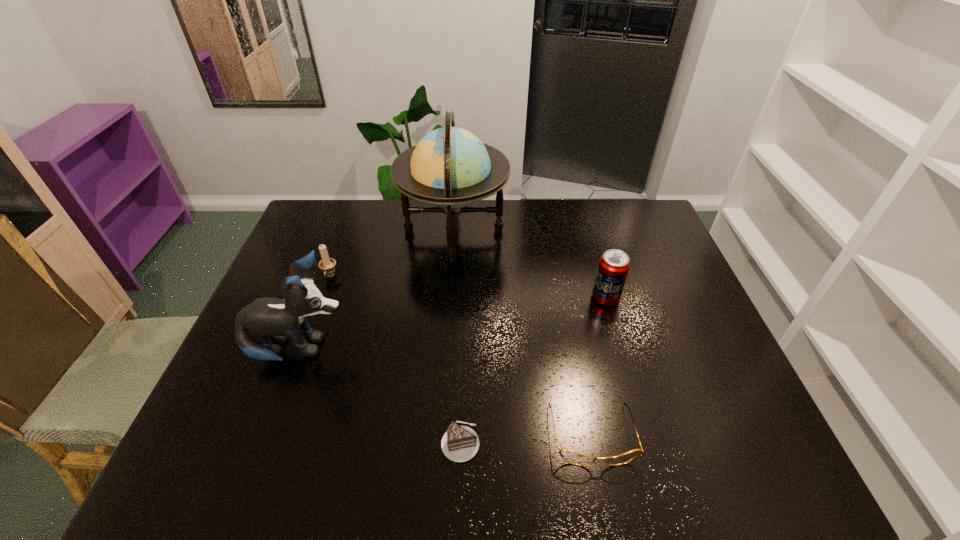
Image resolution: width=960 pixels, height=540 pixels. I want to click on empty space between the chocolate cake and the third nearest object, so [380, 397].

At what (x,y) coordinates should I click in order to perform the action: click on vacant space that's between the fourth nearest object and the third shortest object. Please return your answer as a coordinate pair (x, y). Looking at the image, I should click on (468, 287).

In order to click on free space between the spectacles and the chocolate cake in this screenshot , I will do `click(526, 438)`.

Find the location of a particular element. The image size is (960, 540). vacant space that's between the chocolate cake and the candle_holder is located at coordinates (396, 360).

Identify which object is located as the second nearest to the globe. Please provide its 2D coordinates. Your answer should be formatted as a tuple, i.e. [(x, y)], where the tuple contains the x and y coordinates of a point satisfying the conditions above.

[(613, 268)]

Identify which object is the fourth nearest to the third shortest object. Please provide its 2D coordinates. Your answer should be formatted as a tuple, i.e. [(x, y)], where the tuple contains the x and y coordinates of a point satisfying the conditions above.

[(570, 456)]

Find the location of a particular element. vacant space that satisfies the following two spatial constraints: 1. on the surface of the globe; 2. on the handle side of the candle_holder is located at coordinates (450, 276).

Identify the location of free region that satisfies the following two spatial constraints: 1. on the handle side of the chocolate cake; 2. on the left side of the fifth nearest object. Image resolution: width=960 pixels, height=540 pixels. (270, 442).

Identify the location of free space that satisfies the following two spatial constraints: 1. on the back side of the soda can; 2. on the surface of the farthest object. The width and height of the screenshot is (960, 540). (586, 230).

At what (x,y) coordinates should I click in order to perform the action: click on free space that satisfies the following two spatial constraints: 1. on the handle side of the third shortest object; 2. on the front-facing side of the third nearest object. Please return your answer as a coordinate pair (x, y). Looking at the image, I should click on (303, 351).